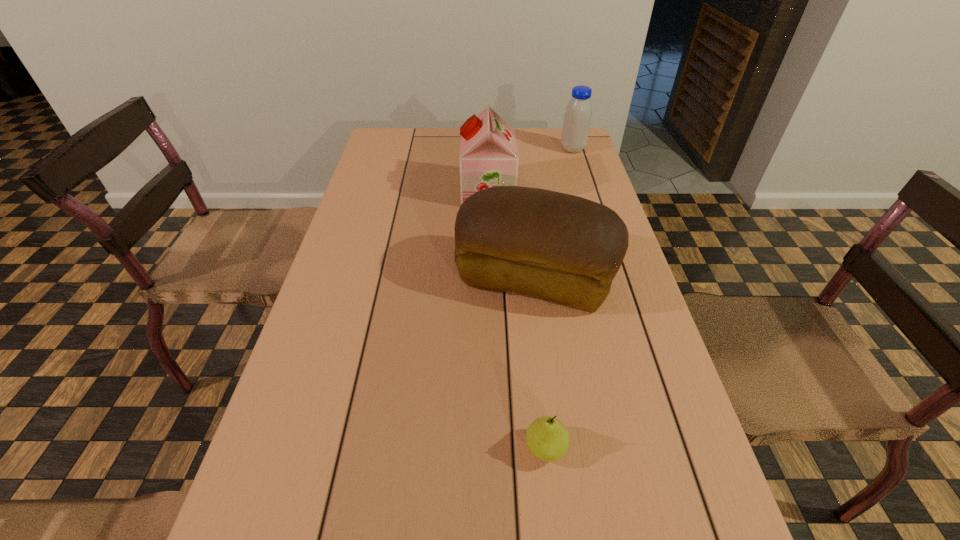
In order to click on vacant region at the far left corner in this screenshot , I will do `click(418, 131)`.

In order to click on free space at the far right corner in this screenshot , I will do `click(565, 156)`.

Find the location of `vacant space that's between the taller soya milk and the farther soya milk`. vacant space that's between the taller soya milk and the farther soya milk is located at coordinates (530, 171).

The height and width of the screenshot is (540, 960). I want to click on vacant space that is in between the taller soya milk and the pear, so click(x=516, y=320).

Find the location of `empty space between the third farthest object and the nearest object`. empty space between the third farthest object and the nearest object is located at coordinates (540, 363).

Identify the location of free spot between the nearer soya milk and the nearest object. Image resolution: width=960 pixels, height=540 pixels. (516, 320).

Find the location of a particular element. vacant space in between the farthest object and the taller soya milk is located at coordinates (530, 171).

The height and width of the screenshot is (540, 960). In order to click on free point between the pear and the third nearest object in this screenshot , I will do `click(516, 320)`.

Choose which object is the second nearest neighbor to the third farthest object. Please provide its 2D coordinates. Your answer should be formatted as a tuple, i.e. [(x, y)], where the tuple contains the x and y coordinates of a point satisfying the conditions above.

[(547, 438)]

The height and width of the screenshot is (540, 960). Find the location of `object that is the second closest to the third farthest object`. object that is the second closest to the third farthest object is located at coordinates (547, 438).